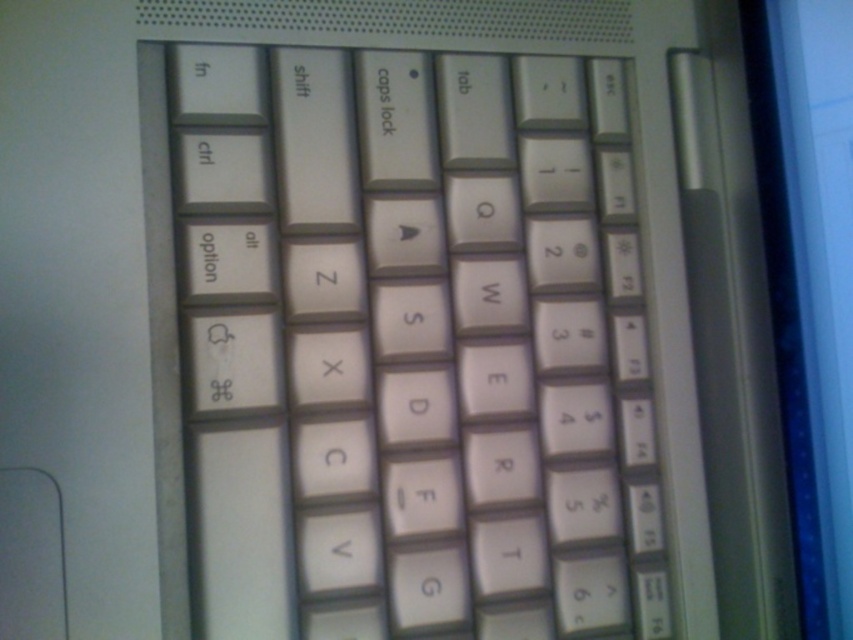
Between point (230, 200) and point (798, 266), which one is positioned in front?

Point (230, 200) is more forward.

The image size is (853, 640). What do you see at coordinates (413, 348) in the screenshot?
I see `white plastic keyboard at center` at bounding box center [413, 348].

Is point (212, 556) closer to viewer compared to point (846, 368)?

Yes, point (212, 556) is in front of point (846, 368).

At what (x,y) coordinates should I click in order to perform the action: click on white plastic keyboard at center. Please return your answer as a coordinate pair (x, y). This screenshot has height=640, width=853. Looking at the image, I should click on coord(413,348).